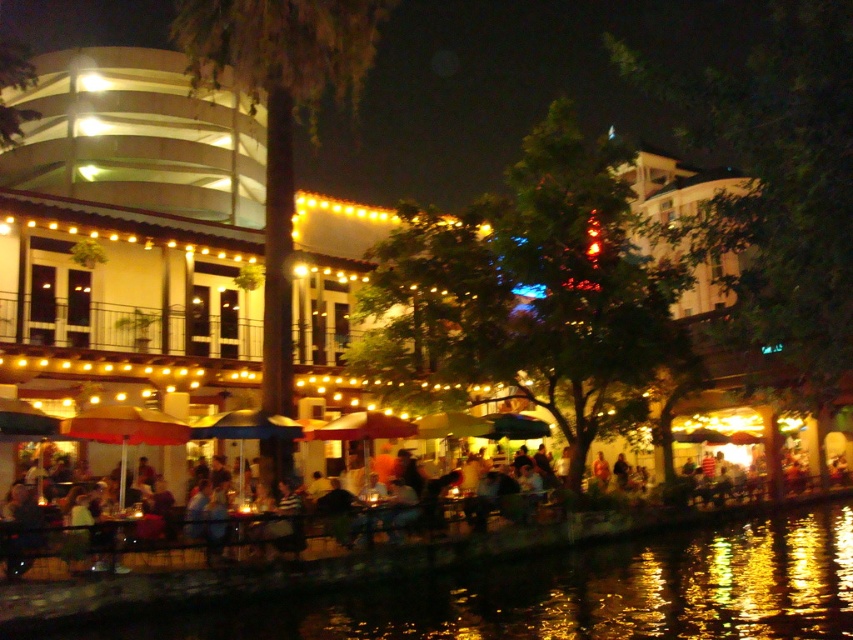
Question: Can you confirm if black reflective water at lower center is positioned to the left of matte black umbrella at lower center?

Choices:
 (A) yes
 (B) no

Answer: (B)

Question: Among these points, which one is farthest from the camera?

Choices:
 (A) (135, 536)
 (B) (726, 513)

Answer: (B)

Question: Is black reflective water at lower center further to the viewer compared to matte black umbrella at lower center?

Choices:
 (A) yes
 (B) no

Answer: (B)

Question: Among these objects, which one is farthest from the camera?

Choices:
 (A) black reflective water at lower center
 (B) matte black umbrella at lower center

Answer: (B)

Question: Which point is closer to the camera?

Choices:
 (A) black reflective water at lower center
 (B) matte black umbrella at lower center

Answer: (A)

Question: Can you confirm if black reflective water at lower center is positioned to the left of matte black umbrella at lower center?

Choices:
 (A) no
 (B) yes

Answer: (A)